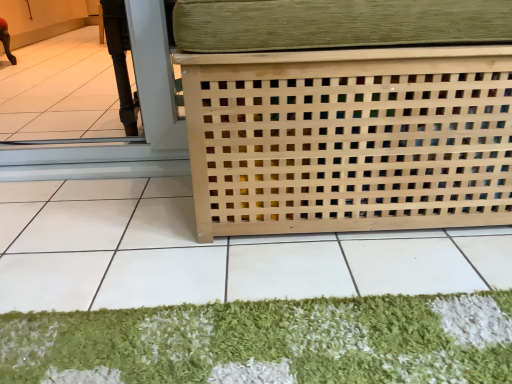
Question: From a real-world perspective, relative to green shaggy mat at lower center, is natural wood lattice at center vertically above or below?

Choices:
 (A) below
 (B) above

Answer: (B)

Question: Looking at their shapes, would you say natural wood lattice at center is wider or thinner than green shaggy mat at lower center?

Choices:
 (A) wide
 (B) thin

Answer: (A)

Question: Which object is positioned closest to the natural wood lattice at center?

Choices:
 (A) green shaggy mat at lower center
 (B) natural wood lattice at center

Answer: (A)

Question: Based on their relative distances, which object is farther from the green shaggy mat at lower center?

Choices:
 (A) natural wood lattice at center
 (B) natural wood lattice at center

Answer: (B)